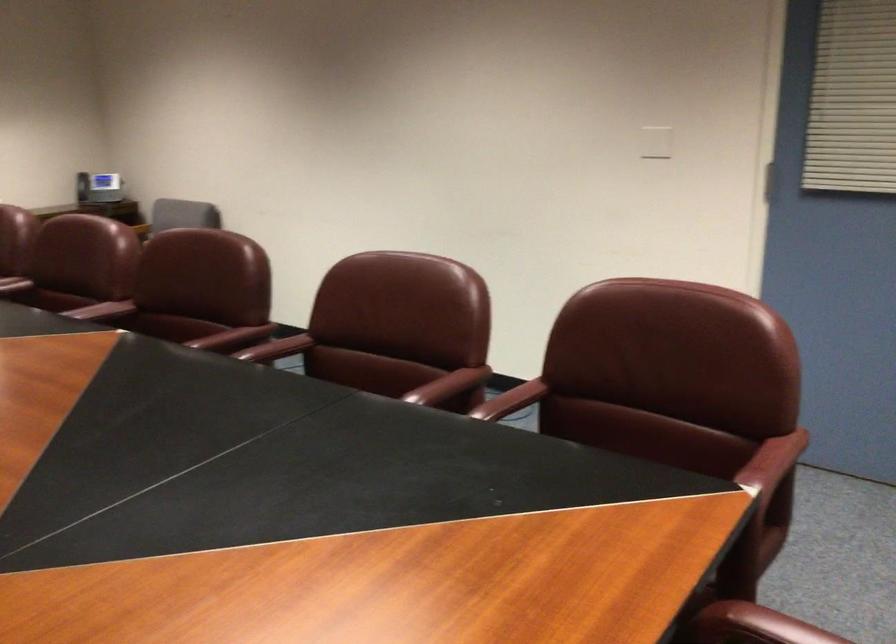
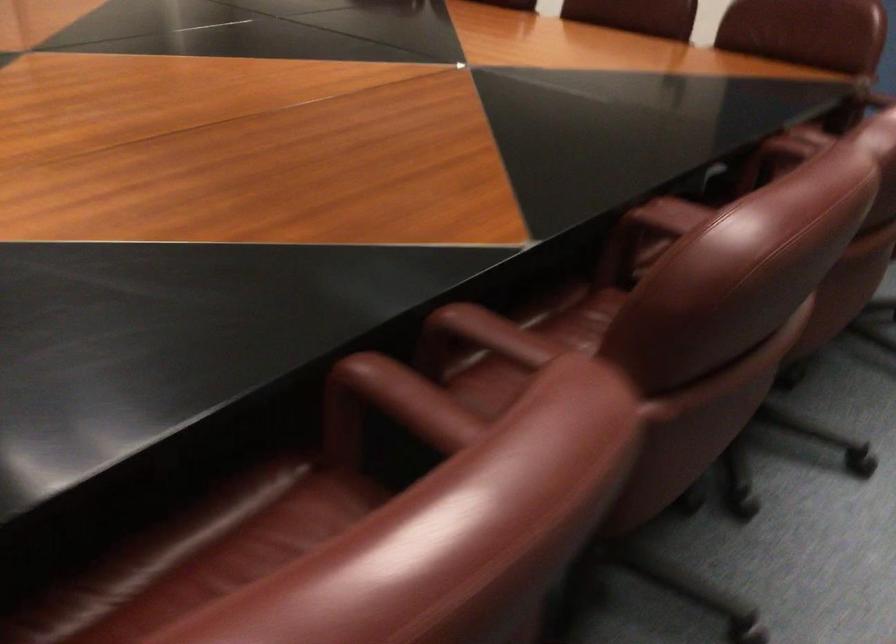
Where in the second image is the point corresponding to pixel 211 333 from the first image?

(493, 334)